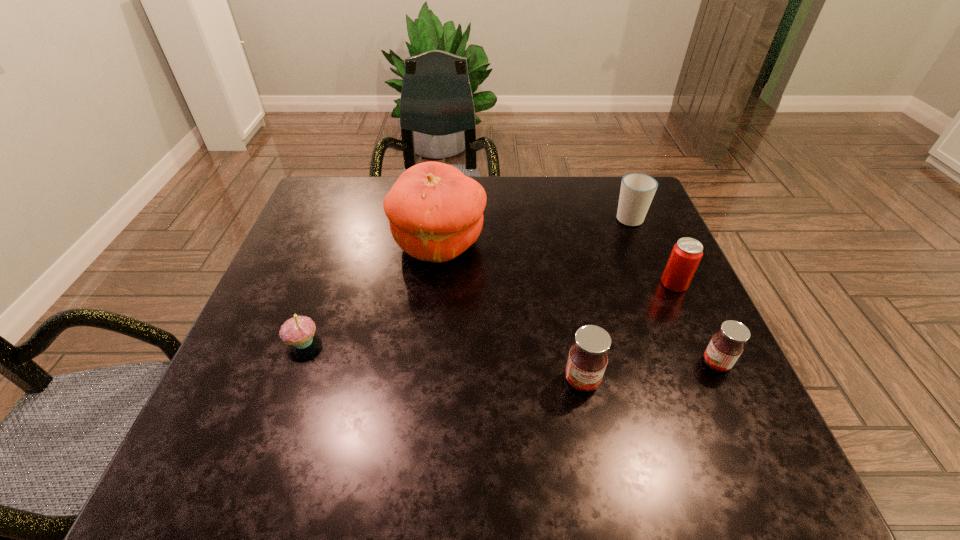
Where is `object at the left edge`? object at the left edge is located at coordinates (298, 331).

Identify the location of jam that is at the right edge. This screenshot has width=960, height=540. (726, 346).

Locate an element on the screen. Image resolution: width=960 pixels, height=540 pixels. cup that is at the right edge is located at coordinates (637, 190).

Where is `can located in the right edge section of the desktop`? can located in the right edge section of the desktop is located at coordinates (686, 254).

You are a GUI agent. You are given a task and a screenshot of the screen. Output one action in this format:
    pyautogui.click(x=<x>, y=<y>)
    Task: Click on the object that is at the far right corner
    This screenshot has height=540, width=960.
    Given the screenshot: What is the action you would take?
    pyautogui.click(x=637, y=190)

Where is `free space at the far edge of the desktop`? free space at the far edge of the desktop is located at coordinates (488, 210).

This screenshot has height=540, width=960. What are the coordinates of `vacant space at the near edge of the desktop` in the screenshot? It's located at (625, 386).

In the image, there is a desktop. Where is `free space at the left edge`? The image size is (960, 540). free space at the left edge is located at coordinates (336, 265).

Where is `vacant space at the right edge`? The image size is (960, 540). vacant space at the right edge is located at coordinates (x=724, y=377).

The image size is (960, 540). What are the coordinates of `free region at the far left corner of the desktop` in the screenshot? It's located at (305, 215).